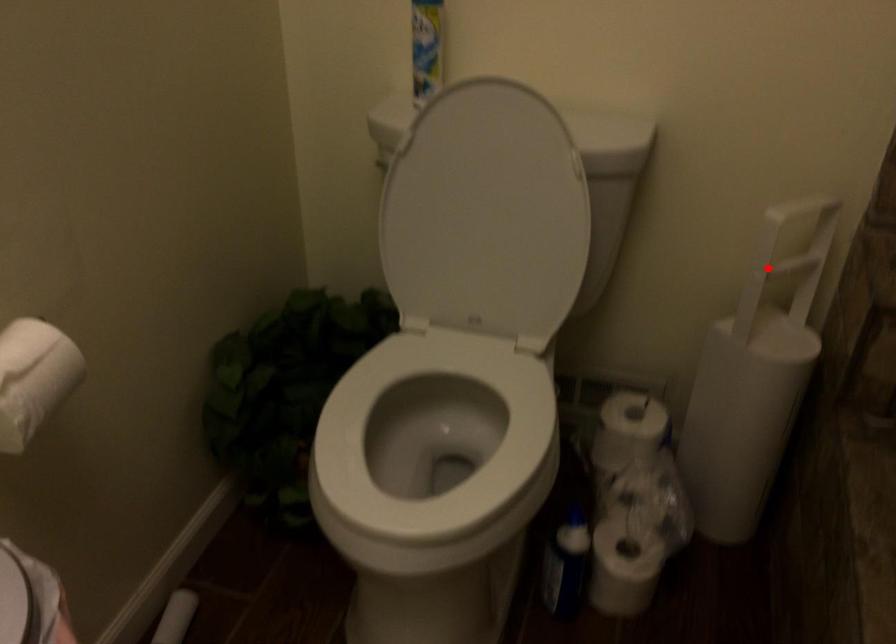
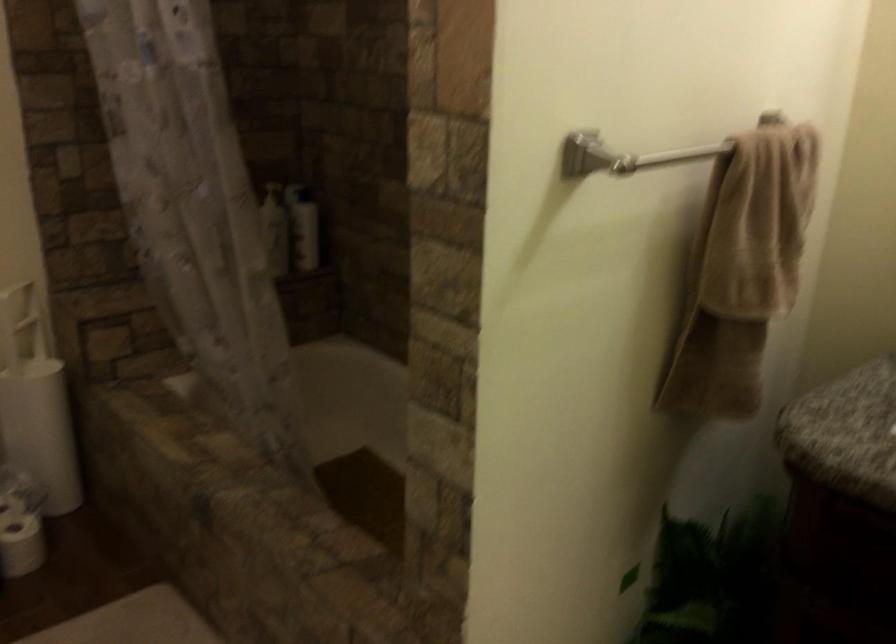
Question: I am providing you with two images of the same scene from different viewpoints. Image1 has a red point marked. In image2, the corresponding 3D location appears at what relative position? Reply with the corresponding letter.

Choices:
 (A) Closer
 (B) Farther

Answer: (B)